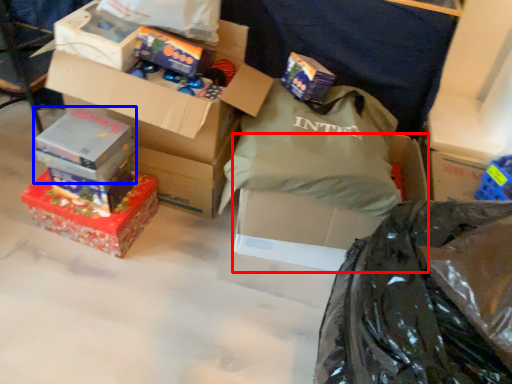
Question: Which point is further to the camera, box (highlighted by a red box) or box (highlighted by a blue box)?

Choices:
 (A) box
 (B) box

Answer: (B)